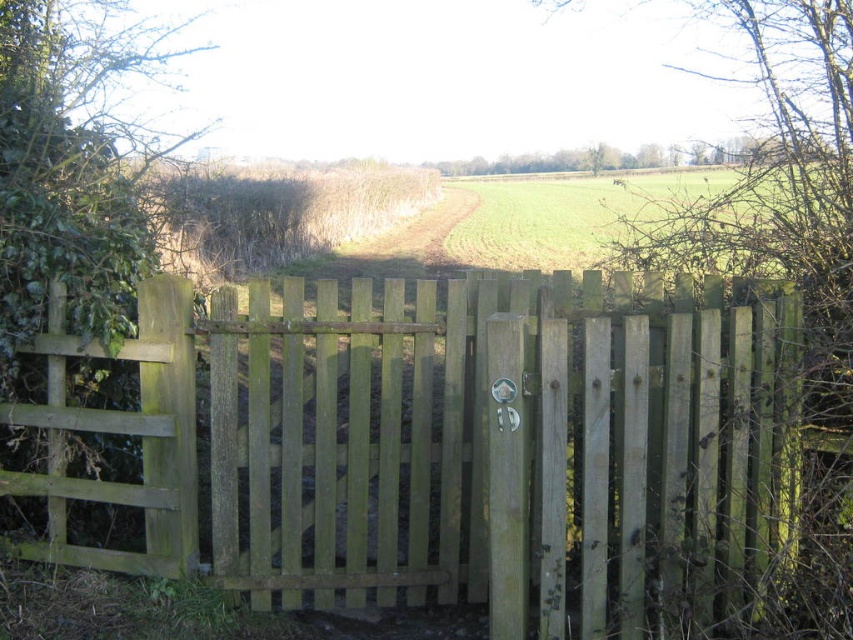
Between brown dry hedge at center and green grass field at center, which one is positioned higher?

brown dry hedge at center is higher up.

In the scene shown: Can you confirm if brown dry hedge at center is shorter than green grass field at center?

No, brown dry hedge at center is not shorter than green grass field at center.

Does point (199, 221) come farther from viewer compared to point (608, 230)?

No, (199, 221) is in front of (608, 230).

Find the location of a particular element. The width and height of the screenshot is (853, 640). brown dry hedge at center is located at coordinates (276, 212).

Which is more to the left, green wooden gate at center or green grass field at center?

From the viewer's perspective, green wooden gate at center appears more on the left side.

Describe the element at coordinates (451, 448) in the screenshot. Image resolution: width=853 pixels, height=640 pixels. I see `green wooden gate at center` at that location.

Who is more forward, (x=154, y=333) or (x=509, y=230)?

Point (x=154, y=333) is more forward.

Find the location of `green wooden gate at center`. green wooden gate at center is located at coordinates (451, 448).

Image resolution: width=853 pixels, height=640 pixels. What do you see at coordinates (451, 448) in the screenshot?
I see `green wooden gate at center` at bounding box center [451, 448].

Who is more distant from viewer, (709, 397) or (271, 266)?

Positioned behind is point (271, 266).

Find the location of a particular element. This screenshot has width=853, height=640. green wooden gate at center is located at coordinates (451, 448).

This screenshot has height=640, width=853. What are the coordinates of `green wooden gate at center` in the screenshot? It's located at (451, 448).